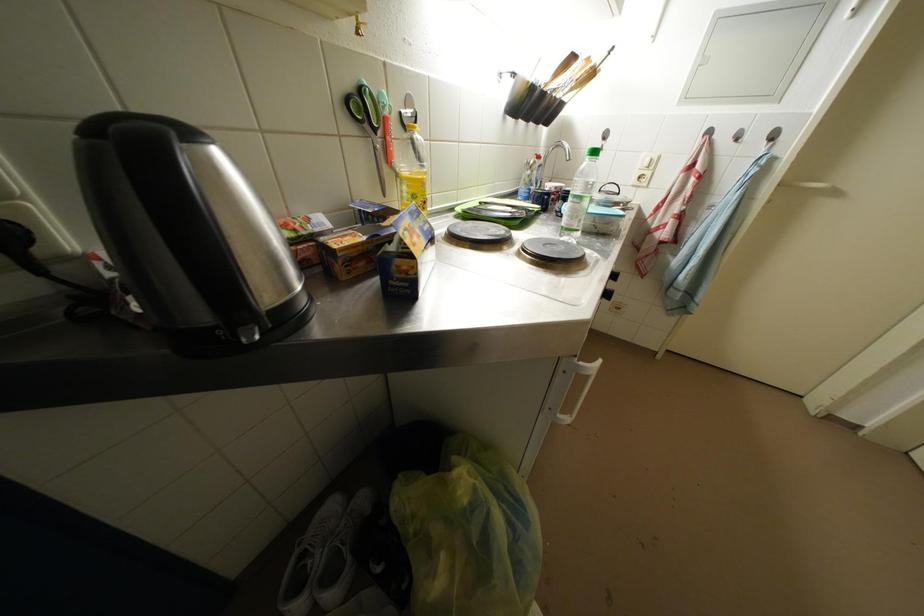
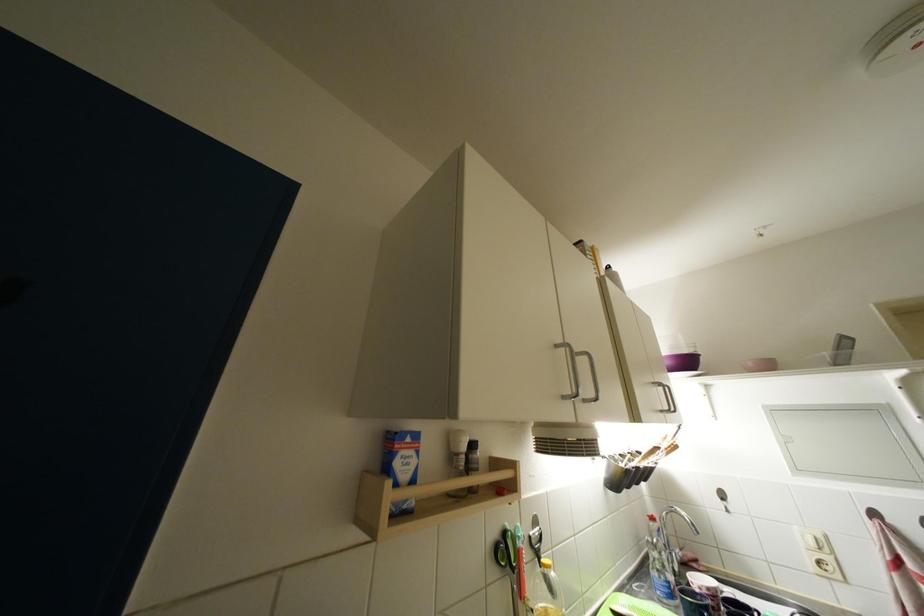
Locate, in the second image, the point that corresponds to pixel 652 168 in the first image.

(820, 548)